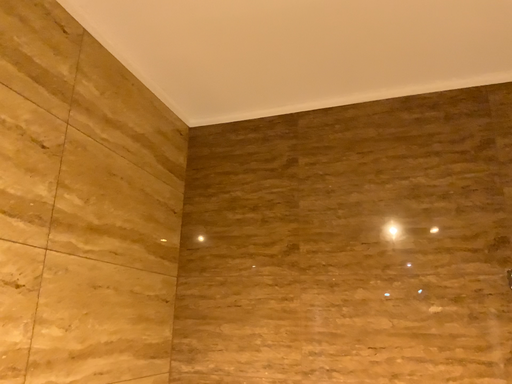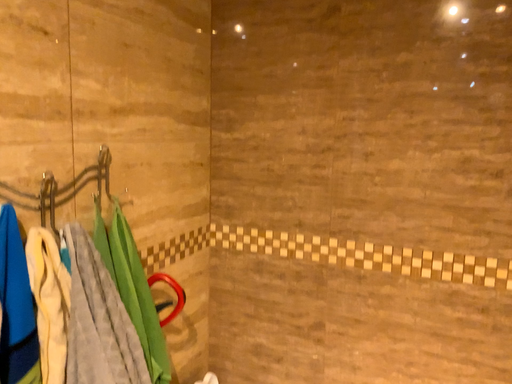
Question: Which way did the camera rotate in the video?

Choices:
 (A) rotated upward
 (B) rotated downward

Answer: (B)